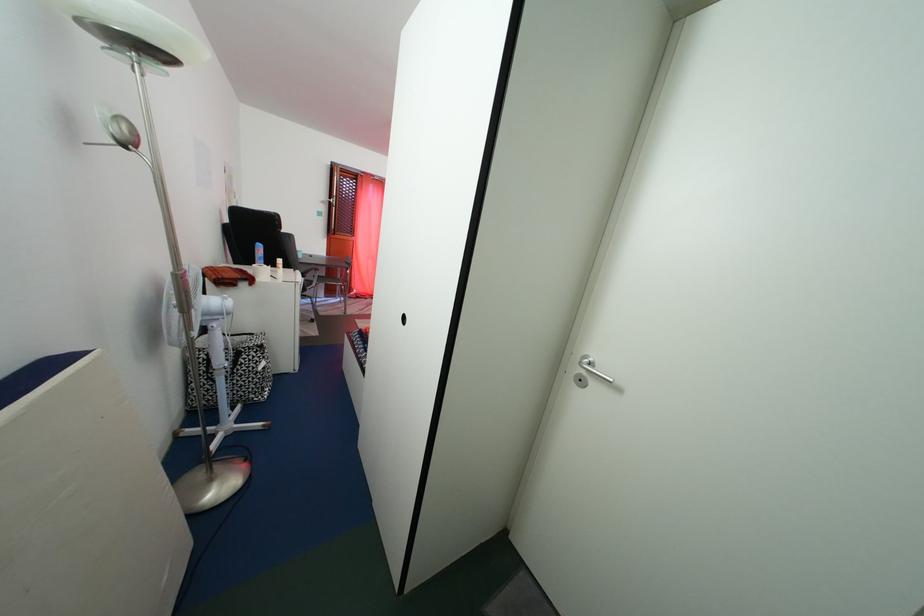
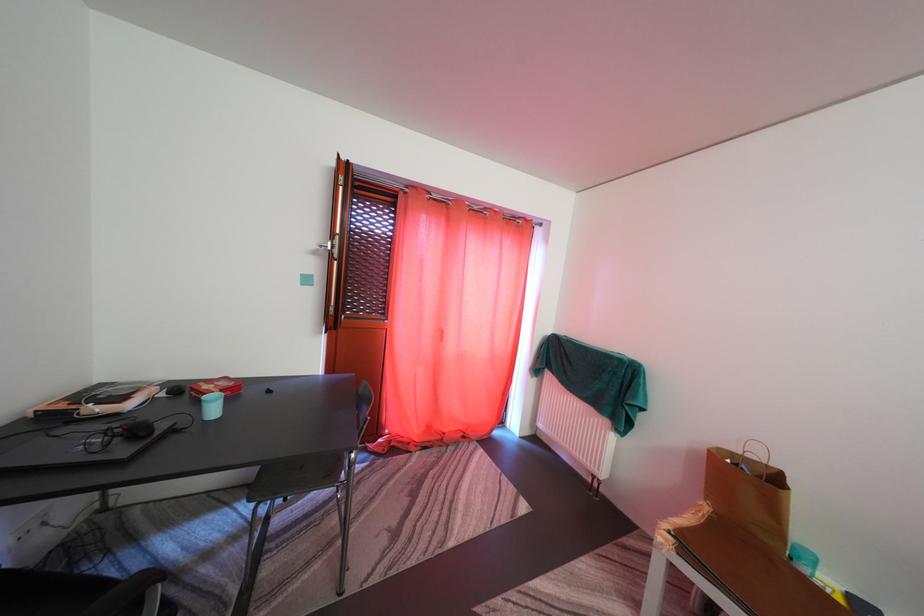
What movement of the cameraman would produce the second image?

The cameraman moved toward left, forward.